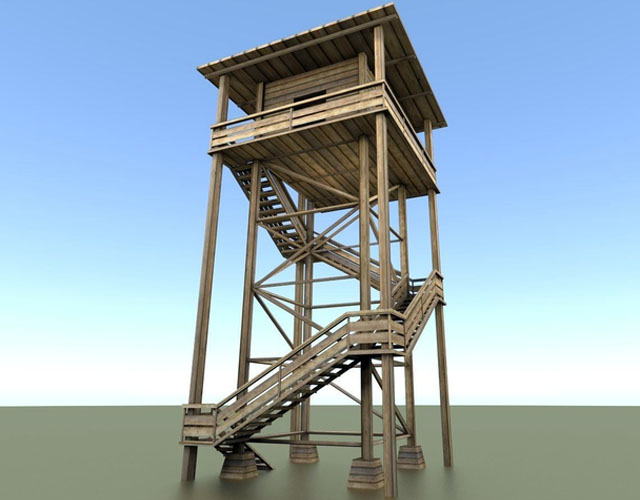
Find the location of a particular element. staircases is located at coordinates (259, 458), (278, 398), (422, 317), (360, 256), (269, 203).